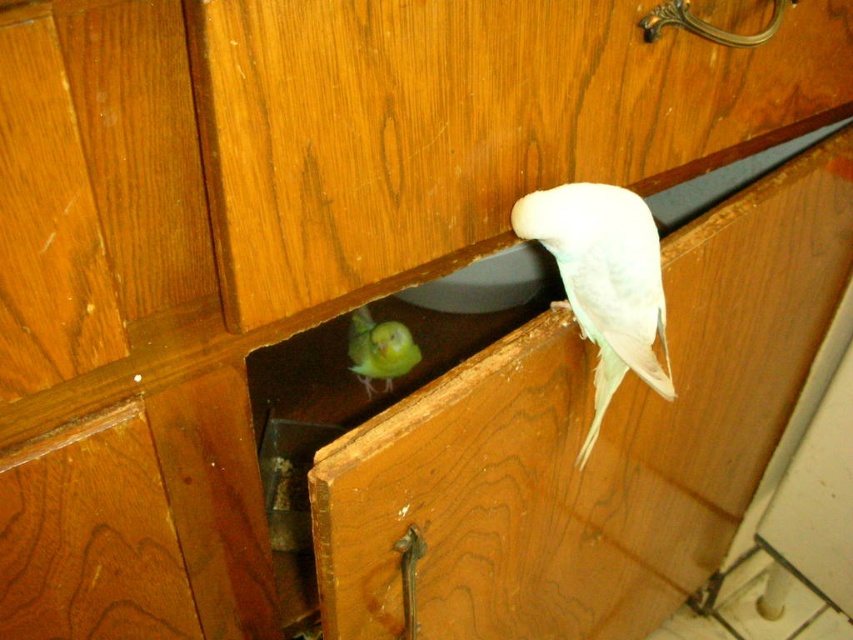
You are a bird enthusiast observing the cabinet. You notice two birds. The white feathered parrot at upper right and the green matte parrot at lower center. Which bird is positioned higher up?

The white feathered parrot at upper right is positioned higher up than the green matte parrot at lower center.